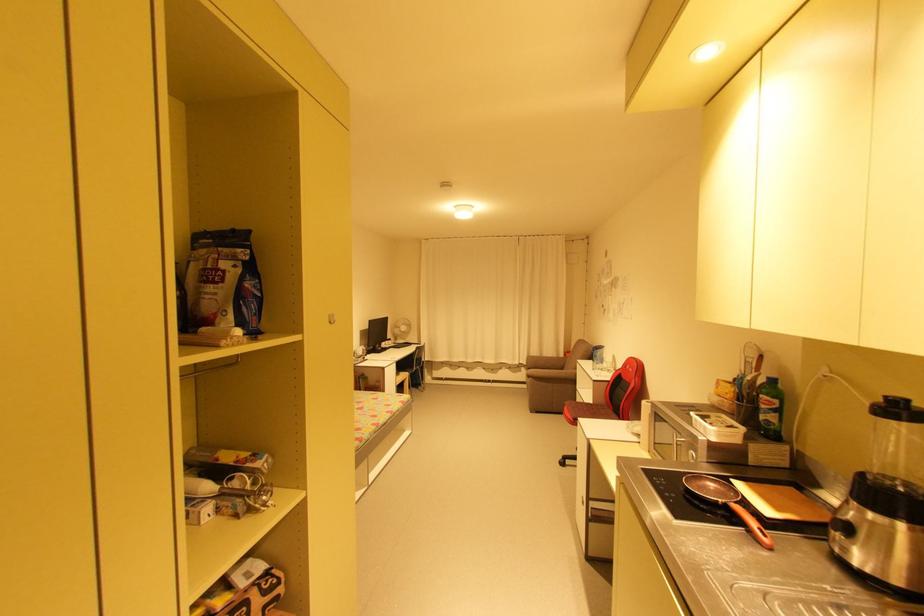
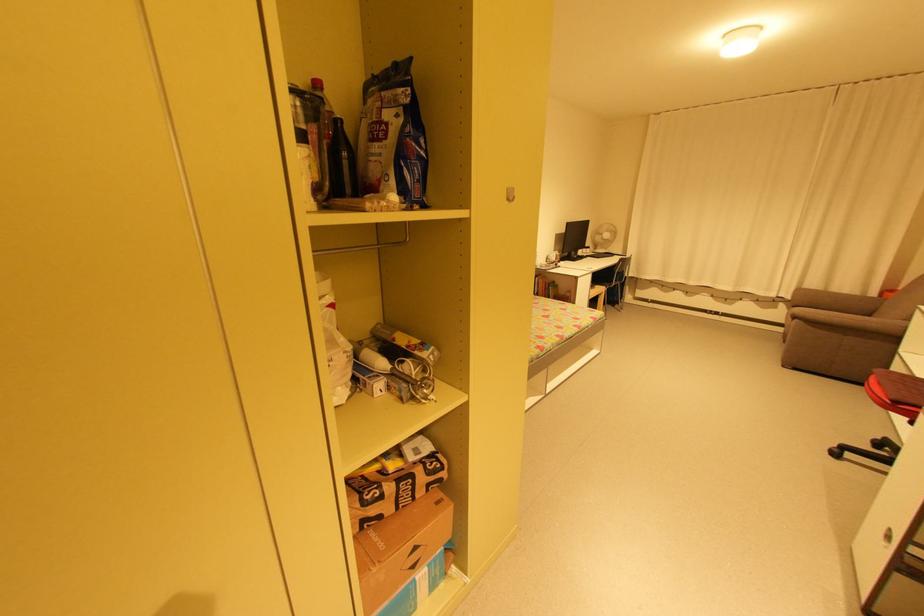
Find the pixel in the second image that matches point (395, 342) in the first image.

(592, 249)